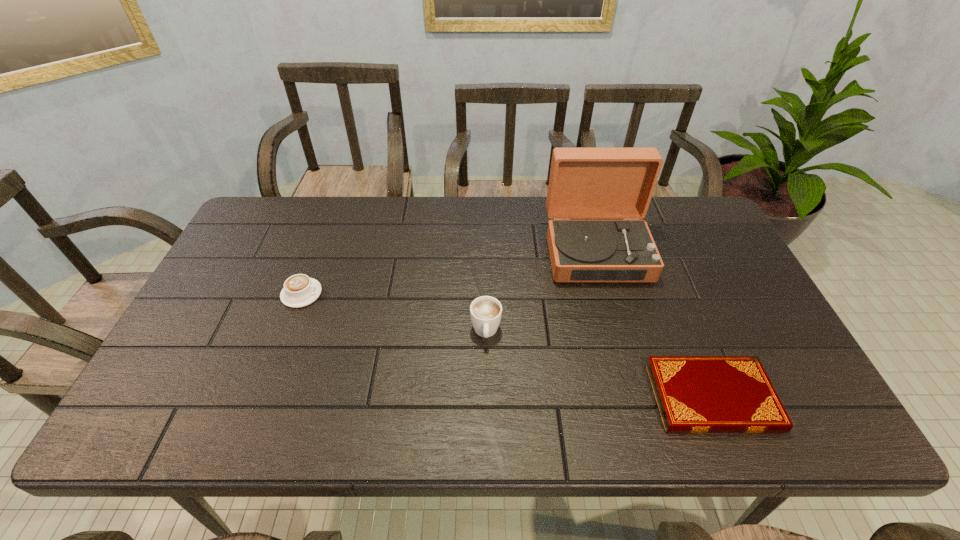
Find the location of `vacant region between the third shortest object and the farther cappuccino`. vacant region between the third shortest object and the farther cappuccino is located at coordinates (394, 313).

This screenshot has height=540, width=960. In order to click on free point between the tallest object and the right cappuccino in this screenshot , I will do `click(541, 292)`.

Locate an element on the screen. The height and width of the screenshot is (540, 960). blank region between the second tallest object and the left cappuccino is located at coordinates (394, 313).

Point out which object is positioned as the nearest to the nearest object. Please provide its 2D coordinates. Your answer should be formatted as a tuple, i.e. [(x, y)], where the tuple contains the x and y coordinates of a point satisfying the conditions above.

[(585, 183)]

Locate an element on the screen. This screenshot has width=960, height=540. object that stands as the second closest to the second nearest object is located at coordinates (695, 394).

This screenshot has height=540, width=960. In order to click on free point that satisfies the following two spatial constraints: 1. on the face of the tallest object; 2. with the handle on the right side of the second shortest object in this screenshot , I will do `click(608, 294)`.